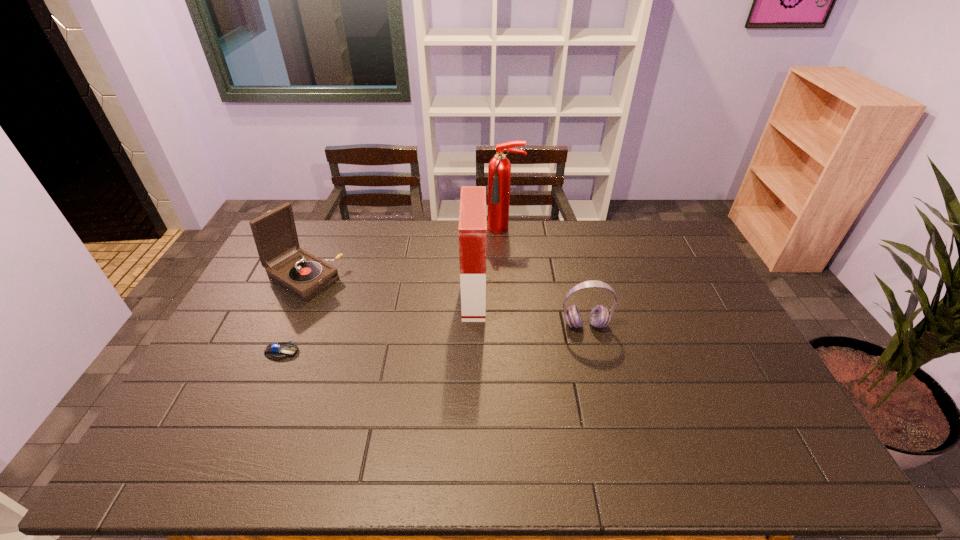
In the image, there is a desktop. In order to click on vacant space at the left edge in this screenshot , I will do `click(243, 403)`.

The height and width of the screenshot is (540, 960). Find the location of `blank space at the right edge of the desktop`. blank space at the right edge of the desktop is located at coordinates (699, 348).

The width and height of the screenshot is (960, 540). I want to click on vacant region at the near left corner of the desktop, so click(193, 462).

The height and width of the screenshot is (540, 960). Identify the location of free point at the far right corner. (685, 256).

The height and width of the screenshot is (540, 960). What are the coordinates of `free space that is in between the phonograph record and the third object from left to right` in the screenshot? It's located at (389, 288).

At what (x,y) coordinates should I click in order to perform the action: click on vacant region between the cigarette_case and the third shortest object. Please return your answer as a coordinate pair (x, y). Looking at the image, I should click on (389, 288).

The width and height of the screenshot is (960, 540). I want to click on vacant space in between the phonograph record and the fire extinguisher, so click(404, 254).

Locate an element on the screen. empty location between the fire extinguisher and the third object from right to left is located at coordinates (490, 264).

Image resolution: width=960 pixels, height=540 pixels. I want to click on empty location between the computer mouse and the third object from right to left, so click(x=378, y=325).

You are a GUI agent. You are given a task and a screenshot of the screen. Output one action in this format:
    pyautogui.click(x=<x>, y=<y>)
    Task: Click on the free space between the headset and the cigarette_case
    Image resolution: width=960 pixels, height=540 pixels.
    Given the screenshot: What is the action you would take?
    pyautogui.click(x=530, y=311)